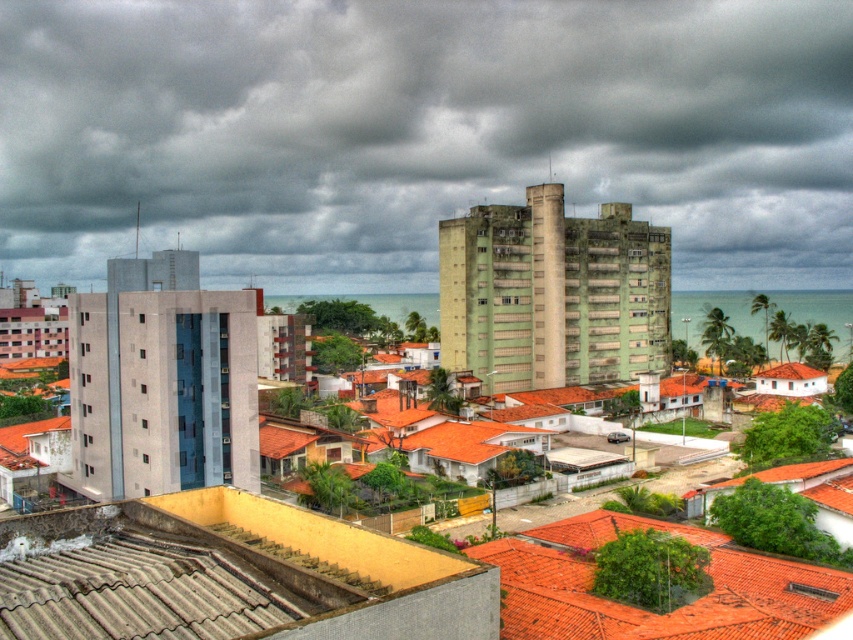
Can you confirm if gray cloudy sky at upper center is positioned above gray corrugated metal roof at lower left?

Yes.

Who is more forward, (764,212) or (254,541)?

Point (254,541)

What do you see at coordinates (421, 132) in the screenshot?
I see `gray cloudy sky at upper center` at bounding box center [421, 132].

Where is `gray cloudy sky at upper center`? Image resolution: width=853 pixels, height=640 pixels. gray cloudy sky at upper center is located at coordinates (421, 132).

Is point (364, 33) closer to viewer compared to point (717, 621)?

No.

Does gray cloudy sky at upper center have a smaller size compared to orange tile roof at lower right?

Incorrect, gray cloudy sky at upper center is not smaller in size than orange tile roof at lower right.

What do you see at coordinates (421, 132) in the screenshot? The width and height of the screenshot is (853, 640). I see `gray cloudy sky at upper center` at bounding box center [421, 132].

Locate an element on the screen. The height and width of the screenshot is (640, 853). gray cloudy sky at upper center is located at coordinates (421, 132).

Between gray corrugated metal roof at lower left and orange tile roof at lower right, which one appears on the left side from the viewer's perspective?

From the viewer's perspective, gray corrugated metal roof at lower left appears more on the left side.

Does gray corrugated metal roof at lower left appear on the left side of orange tile roof at lower right?

Yes, gray corrugated metal roof at lower left is to the left of orange tile roof at lower right.

Which is in front, point (405, 609) or point (788, 614)?

Point (405, 609)

The width and height of the screenshot is (853, 640). Identify the location of gray corrugated metal roof at lower left. (229, 573).